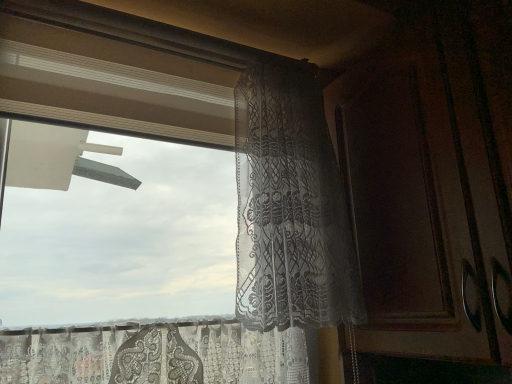
This screenshot has height=384, width=512. I want to click on transparent lace curtain at center, so click(x=290, y=208).

What do you see at coordinates (290, 208) in the screenshot? I see `transparent lace curtain at center` at bounding box center [290, 208].

Locate an element on the screen. transparent lace curtain at center is located at coordinates (290, 208).